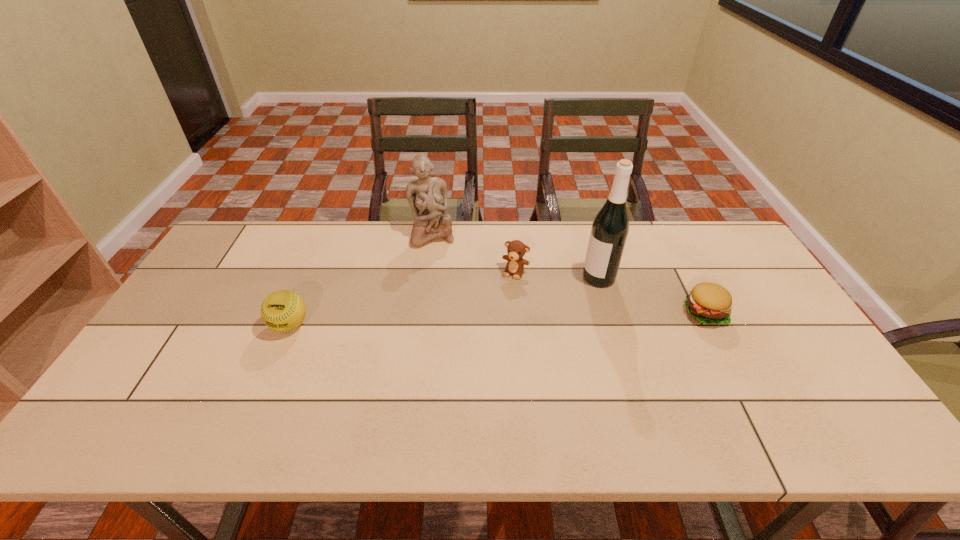
In order to click on empty location between the rightmost object and the third object from right to left in this screenshot , I will do `click(611, 292)`.

The width and height of the screenshot is (960, 540). Find the location of `vacant space in between the third object from right to left and the leftmost object`. vacant space in between the third object from right to left and the leftmost object is located at coordinates (402, 299).

Find the location of `vacant space that is in between the leftmost object and the fourth object from left to right`. vacant space that is in between the leftmost object and the fourth object from left to right is located at coordinates (444, 301).

The width and height of the screenshot is (960, 540). In order to click on object that is the third closest to the figurine in this screenshot , I will do coord(610,228).

Identify which object is located as the second nearest to the fourth object from right to left. Please provide its 2D coordinates. Your answer should be formatted as a tuple, i.e. [(x, y)], where the tuple contains the x and y coordinates of a point satisfying the conditions above.

[(283, 310)]

At what (x,y) coordinates should I click in order to perform the action: click on free space in the image that satisfies the following two spatial constraints: 1. on the front side of the third object from right to left; 2. on the right side of the second object from right to left. Please return your answer as a coordinate pair (x, y). The height and width of the screenshot is (540, 960). Looking at the image, I should click on (516, 278).